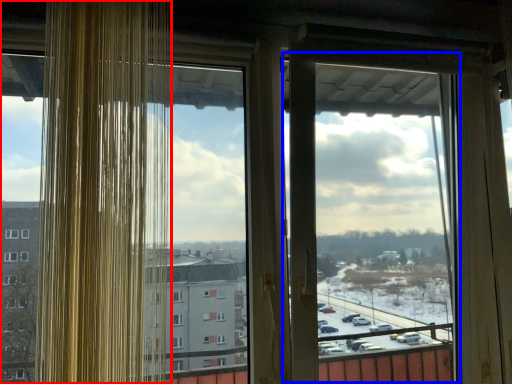
Question: Which of the following is the closest to the observer, window (highlighted by a red box) or screen door (highlighted by a blue box)?

Choices:
 (A) window
 (B) screen door

Answer: (A)